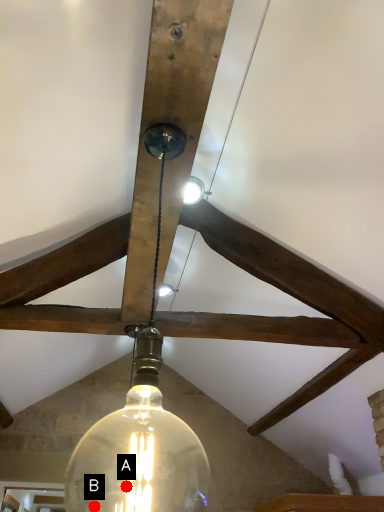
Question: Two points are circled on the image, labeled by A and B beside each circle. Which point is closer to the camera?

Choices:
 (A) A is closer
 (B) B is closer

Answer: (A)